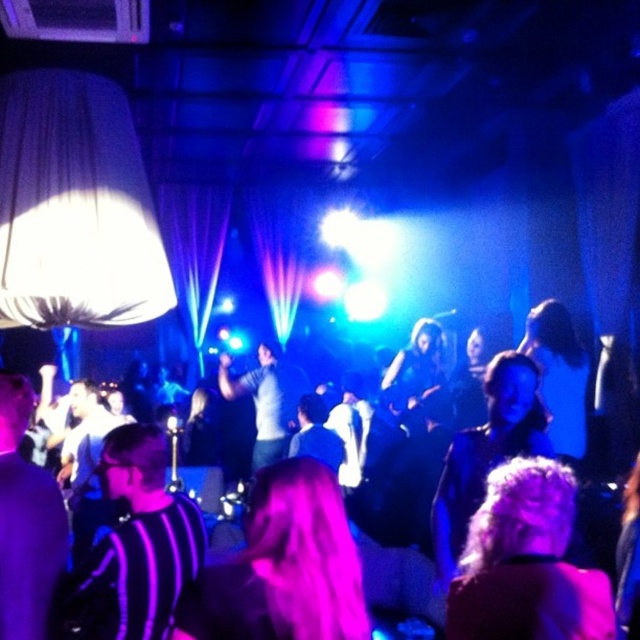
Is curly hair at center further to camera compared to dark gray shirt at center?

No, it is not.

Does point (486, 477) come in front of point (268, 404)?

Yes, it is.

Where is `curly hair at center`? curly hair at center is located at coordinates (525, 563).

Does curly hair at center lie in front of black striped shirt at lower left?

Yes.

Who is taller, curly hair at center or black striped shirt at lower left?

With more height is black striped shirt at lower left.

Where is `curly hair at center`? Image resolution: width=640 pixels, height=640 pixels. curly hair at center is located at coordinates (525, 563).

Is striped fabric shirt at center thinner than dark gray shirt at center?

Indeed, striped fabric shirt at center has a lesser width compared to dark gray shirt at center.

Between striped fabric shirt at center and dark gray shirt at center, which one is positioned higher?

Positioned higher is striped fabric shirt at center.

Locate an element on the screen. The height and width of the screenshot is (640, 640). striped fabric shirt at center is located at coordinates (524, 406).